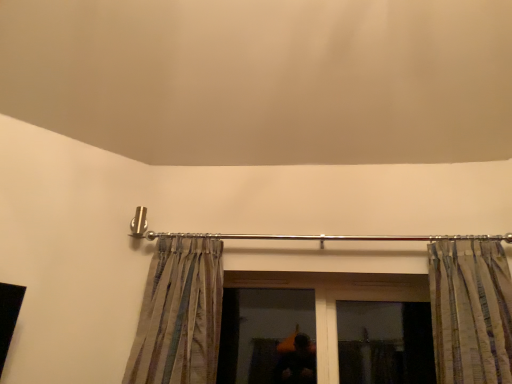
Question: From a real-world perspective, is silky striped curtain at left, the first curtain in the left-to-right sequence, physically located above or below transparent glass window at center?

Choices:
 (A) above
 (B) below

Answer: (A)

Question: In terms of width, does silky striped curtain at left, which is the 2th curtain from right to left, look wider or thinner when compared to transparent glass window at center?

Choices:
 (A) thin
 (B) wide

Answer: (B)

Question: Which of these objects is positioned farthest from the silky striped curtain at left, which is the 2th curtain from right to left?

Choices:
 (A) striped fabric curtain at upper right, which ranks as the second curtain in left-to-right order
 (B) transparent glass window at center

Answer: (A)

Question: Which is nearer to the silky striped curtain at left, the first curtain in the left-to-right sequence?

Choices:
 (A) transparent glass window at center
 (B) striped fabric curtain at upper right, the 1th curtain positioned from the right

Answer: (A)